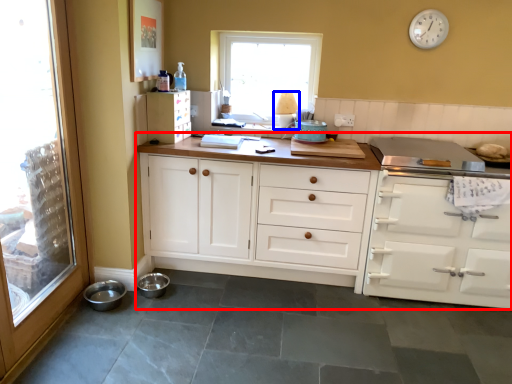
Question: Among these objects, which one is nearest to the camera, cabinetry (highlighted by a red box) or lamp (highlighted by a blue box)?

Choices:
 (A) cabinetry
 (B) lamp

Answer: (A)